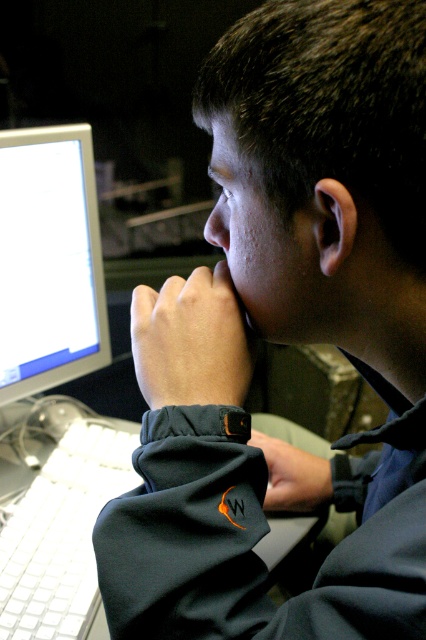
Question: Estimate the real-world distances between objects in this image. Which object is closer to the skinny white hand at center?

Choices:
 (A) matte silver monitor at left
 (B) white plastic keyboard at lower left
 (C) black fabric hand at lower center

Answer: (C)

Question: Can you confirm if matte silver monitor at left is positioned above skinny white hand at center?

Choices:
 (A) yes
 (B) no

Answer: (A)

Question: Estimate the real-world distances between objects in this image. Which object is closer to the black fabric hand at lower center?

Choices:
 (A) matte silver monitor at left
 (B) white plastic keyboard at lower left

Answer: (B)

Question: Observing the image, what is the correct spatial positioning of skinny white hand at center in reference to black fabric hand at lower center?

Choices:
 (A) below
 (B) above

Answer: (B)

Question: Does matte silver monitor at left appear under white plastic keyboard at lower left?

Choices:
 (A) yes
 (B) no

Answer: (B)

Question: Which object is the farthest from the black fabric hand at lower center?

Choices:
 (A) skinny white hand at center
 (B) matte silver monitor at left
 (C) white plastic keyboard at lower left

Answer: (B)